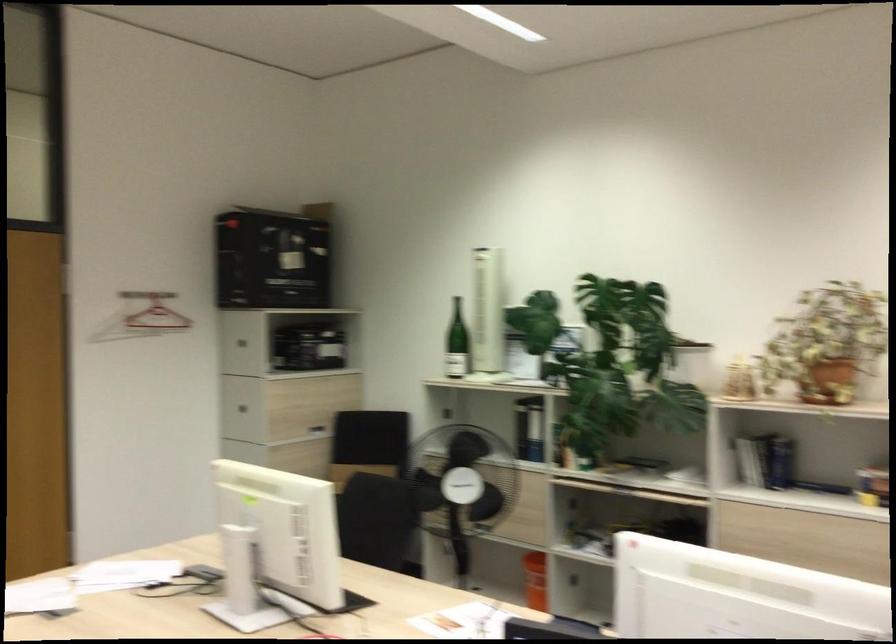
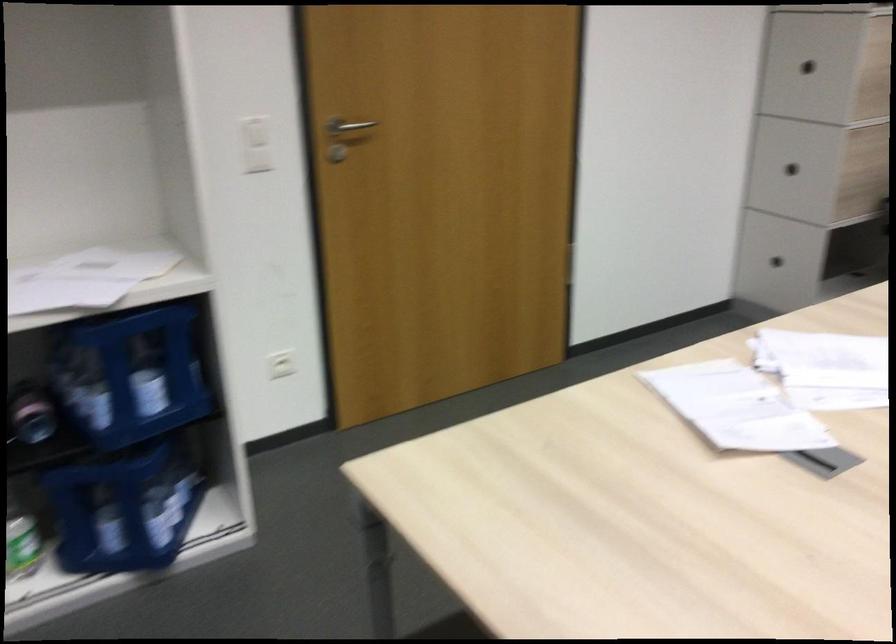
Which direction would the cameraman need to move to produce the second image?

The cameraman moved toward left, forward.